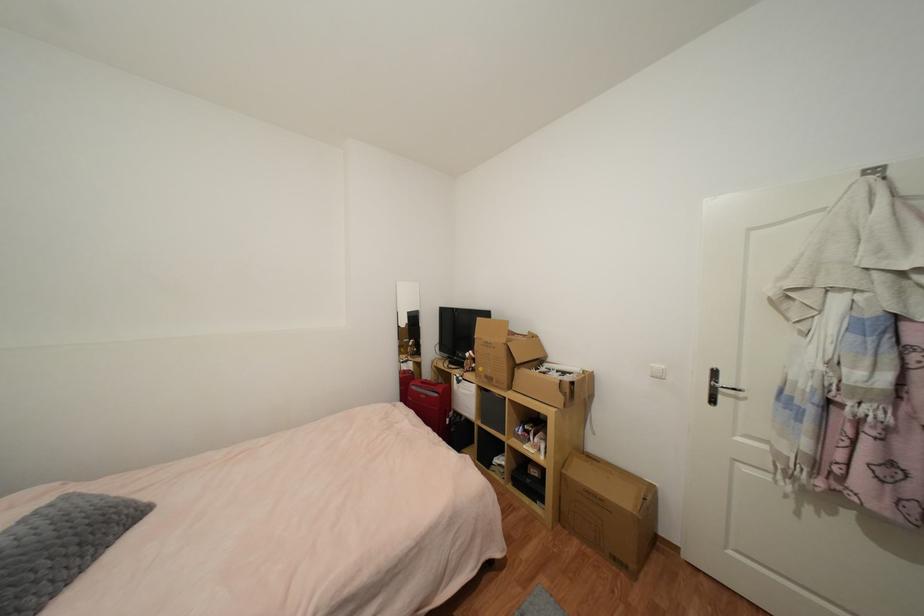
The image size is (924, 616). I want to click on cardboard box, so click(x=609, y=511).